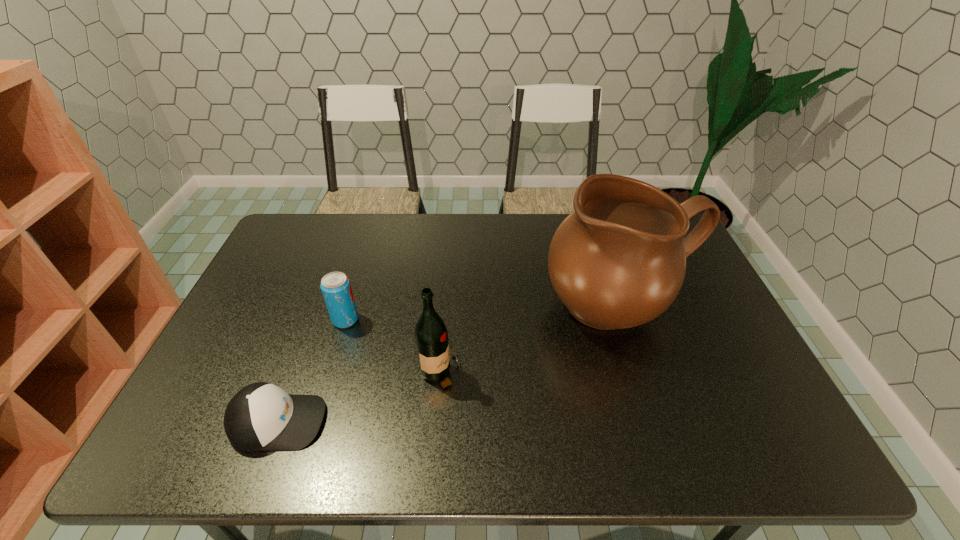
The height and width of the screenshot is (540, 960). I want to click on cream pitcher, so click(x=618, y=261).

Find the location of a particular element. the rightmost object is located at coordinates (618, 261).

Where is `the third shortest object`? The image size is (960, 540). the third shortest object is located at coordinates (431, 336).

Image resolution: width=960 pixels, height=540 pixels. Identify the location of wine bottle. (431, 336).

Identify the location of soda can. The width and height of the screenshot is (960, 540). (335, 286).

The height and width of the screenshot is (540, 960). What are the coordinates of `cap` in the screenshot? It's located at (261, 416).

Find the location of `the shortest object`. the shortest object is located at coordinates (261, 416).

Where is `vacant space positioned at the spout of the tallest object`? This screenshot has width=960, height=540. vacant space positioned at the spout of the tallest object is located at coordinates (667, 450).

The height and width of the screenshot is (540, 960). What are the coordinates of `vacant space located on the right of the wine bottle` in the screenshot? It's located at (588, 374).

Locate an element on the screen. The height and width of the screenshot is (540, 960). vacant point located on the left of the third tallest object is located at coordinates (315, 320).